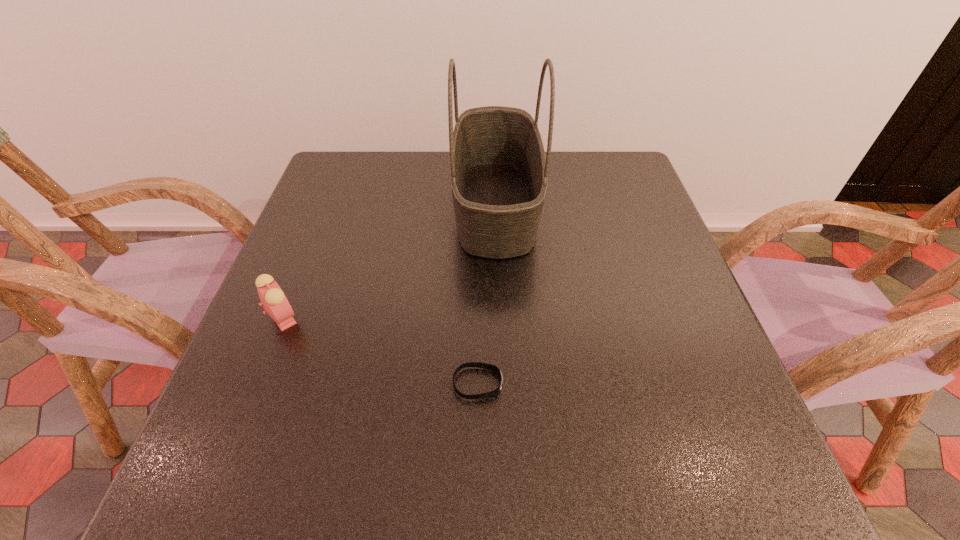
The image size is (960, 540). Find the location of `free point that satisfies the following two spatial constraints: 1. on the front side of the tallest object; 2. on the face of the second nearest object`. free point that satisfies the following two spatial constraints: 1. on the front side of the tallest object; 2. on the face of the second nearest object is located at coordinates (500, 318).